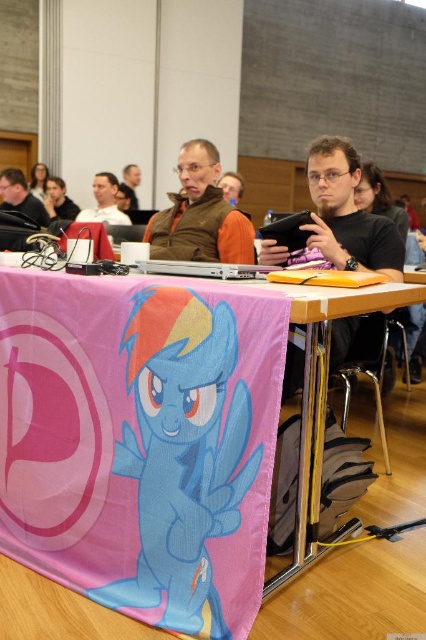
Which is more to the left, brown fuzzy vest at center or matte black laptop at left?

matte black laptop at left is more to the left.

Consider the image. Is brown fuzzy vest at center shorter than matte black laptop at left?

No.

Image resolution: width=426 pixels, height=640 pixels. Describe the element at coordinates (199, 214) in the screenshot. I see `brown fuzzy vest at center` at that location.

You are a GUI agent. You are given a task and a screenshot of the screen. Output one action in this format:
    pyautogui.click(x=<x>, y=<y>)
    Task: Click on the brown fuzzy vest at center
    The image size is (426, 640).
    Given the screenshot: What is the action you would take?
    pyautogui.click(x=199, y=214)

Is point (226, 246) less distant than point (129, 202)?

Yes, it is.

Can you confirm if brown fuzzy vest at center is shorter than matte brown jacket at center?

In fact, brown fuzzy vest at center may be taller than matte brown jacket at center.

The width and height of the screenshot is (426, 640). What are the coordinates of `brown fuzzy vest at center` in the screenshot? It's located at (199, 214).

Identify the location of brown fuzzy vest at center. This screenshot has width=426, height=640. [199, 214].

Where is `matte black laptop at left`? The height and width of the screenshot is (640, 426). matte black laptop at left is located at coordinates (20, 196).

I want to click on matte black laptop at left, so click(20, 196).